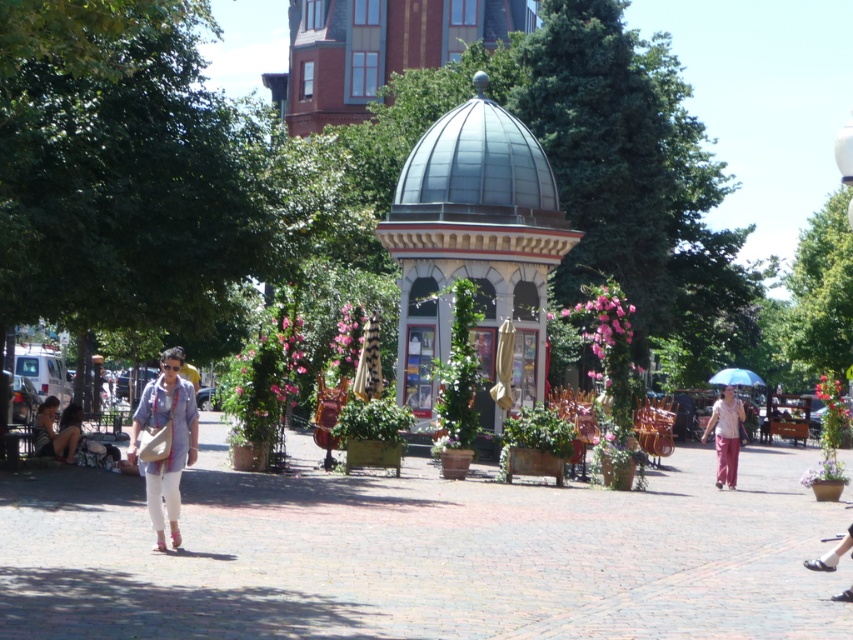
Question: Which object appears closest to the camera in this image?

Choices:
 (A) matte white pants at center-left
 (B) green leafy tree at center
 (C) transparent blue umbrella at lower right
 (D) pink fabric umbrella at right

Answer: (A)

Question: Is green leafy tree at upper right above pink fabric umbrella at right?

Choices:
 (A) no
 (B) yes

Answer: (B)

Question: Estimate the real-world distances between objects in this image. Which object is farther from the matte white pants at center-left?

Choices:
 (A) transparent blue umbrella at lower right
 (B) pink fabric umbrella at right
 (C) metallic dome gazebo at center

Answer: (A)

Question: Can you confirm if green leafy tree at left is positioned to the right of matte white pants at center-left?

Choices:
 (A) yes
 (B) no

Answer: (B)

Question: Estimate the real-world distances between objects in this image. Which object is farther from the metallic dome gazebo at center?

Choices:
 (A) green leafy tree at upper right
 (B) matte white pants at center-left
 (C) green leafy tree at left

Answer: (A)

Question: Is green leafy tree at center further to camera compared to metallic dome gazebo at center?

Choices:
 (A) no
 (B) yes

Answer: (A)